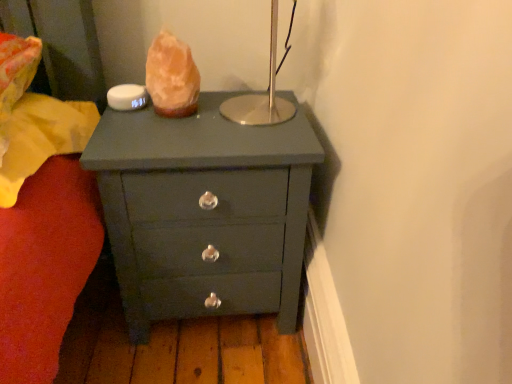
Identify the location of vacant area that is in front of orange crystal at center. The width and height of the screenshot is (512, 384). (167, 131).